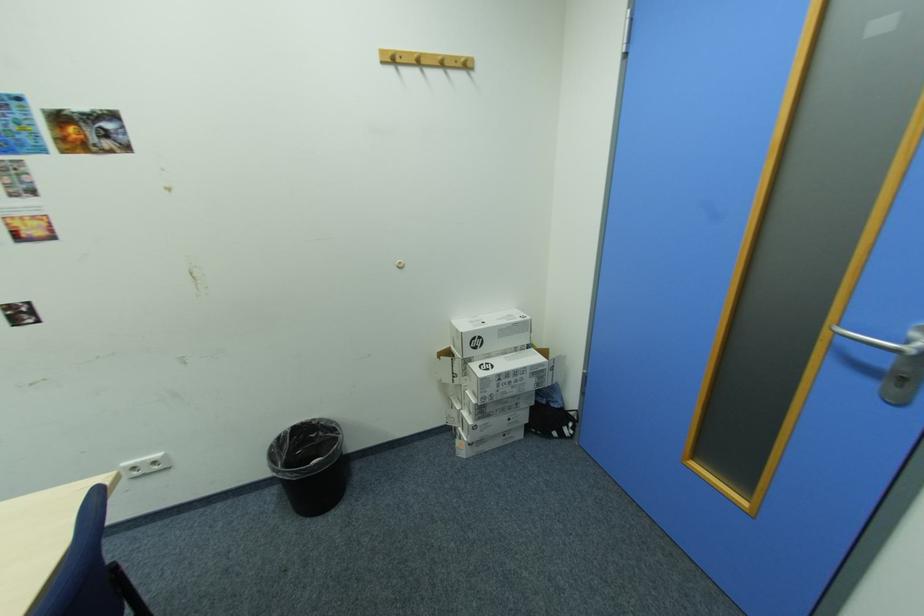
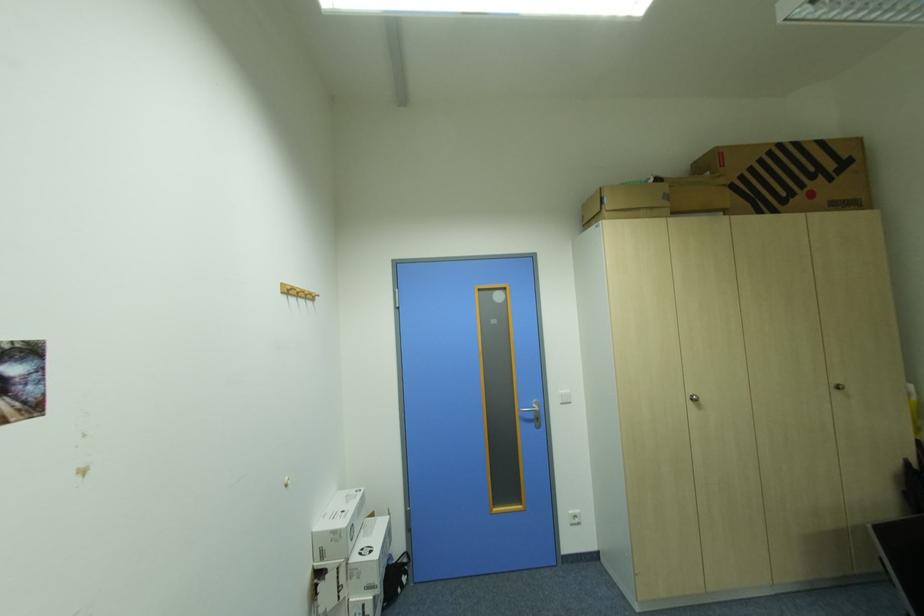
Locate, in the second image, the point that corresponds to (x=465, y=331) in the first image.

(341, 533)